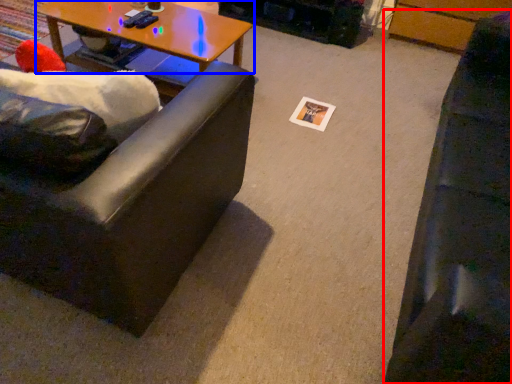
Question: Which object is further to the camera taking this photo, studio couch (highlighted by a red box) or coffee table (highlighted by a blue box)?

Choices:
 (A) studio couch
 (B) coffee table

Answer: (B)